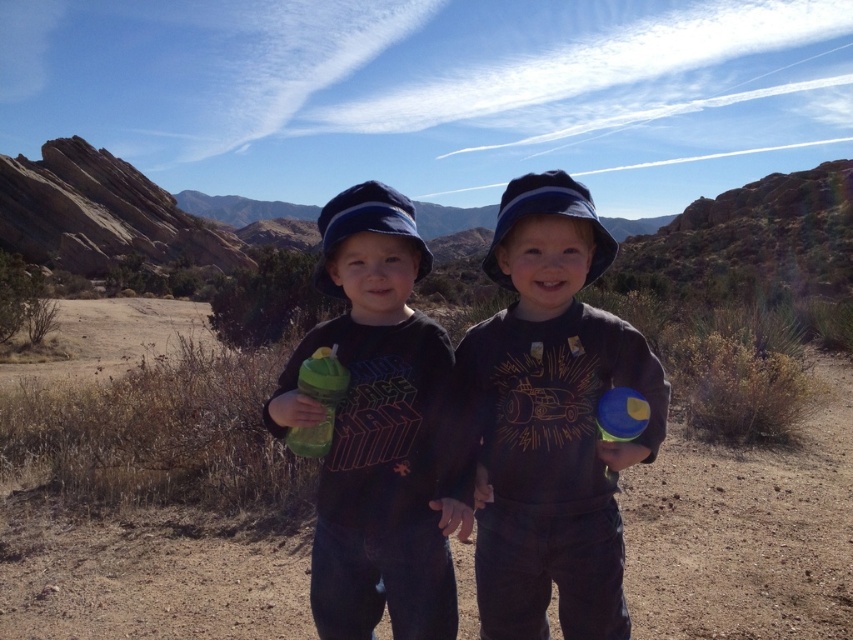
Does dark gray cotton shirt at center appear on the left side of matte black shirt at center?

In fact, dark gray cotton shirt at center is to the right of matte black shirt at center.

Who is more forward, (479, 458) or (334, 637)?

Positioned in front is point (334, 637).

Who is more distant from viewer, (569,397) or (381,374)?

The point (381,374) is more distant.

Locate an element on the screen. The width and height of the screenshot is (853, 640). dark gray cotton shirt at center is located at coordinates (552, 420).